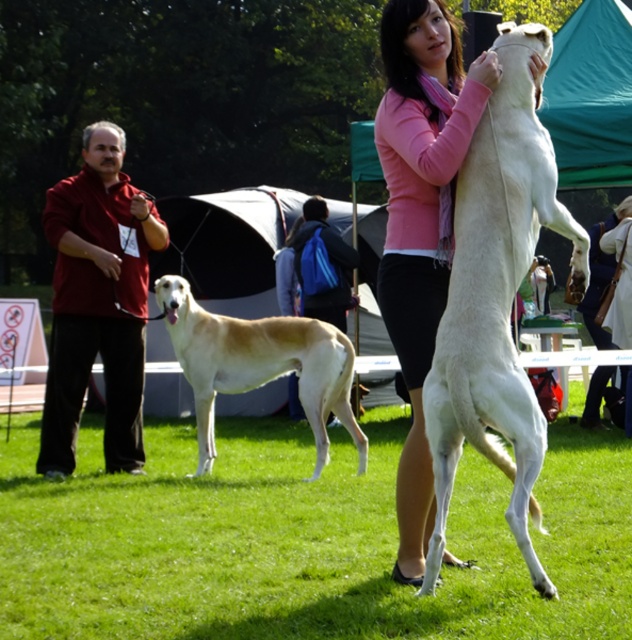
Question: Which object appears closest to the camera in this image?

Choices:
 (A) light beige fur at center
 (B) pink fabric at center

Answer: (A)

Question: Which of the following is the farthest from the observer?

Choices:
 (A) (202, 314)
 (B) (80, 349)
 (C) (621, 285)

Answer: (C)

Question: Which object is closer to the camera taking this photo?

Choices:
 (A) red fleece jacket at left
 (B) light beige fur at center
 (C) pink fabric at center
 (D) white smooth dog at center

Answer: (D)

Question: Observing the image, what is the correct spatial positioning of white smooth dog at center in reference to red fleece jacket at left?

Choices:
 (A) left
 (B) right

Answer: (B)

Question: Is white smooth dog at center thinner than light beige fur at center?

Choices:
 (A) no
 (B) yes

Answer: (B)

Question: Does pink fabric scarf at upper center lie behind red fleece jacket at left?

Choices:
 (A) yes
 (B) no

Answer: (B)